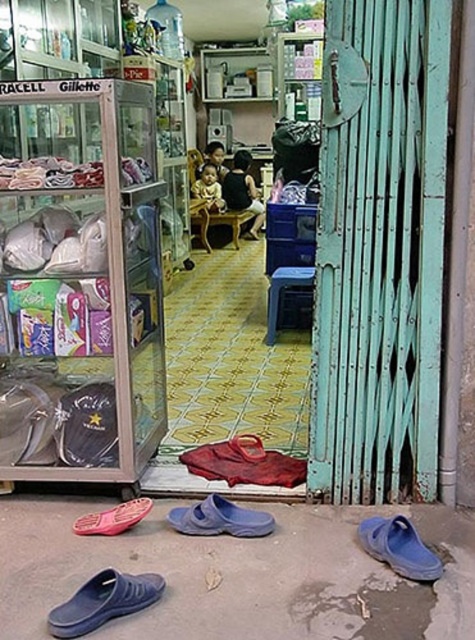
Question: Is transparent plastic display case at left to the right of teal painted metal gate at right from the viewer's perspective?

Choices:
 (A) yes
 (B) no

Answer: (B)

Question: Estimate the real-world distances between objects in this image. Which object is farther from the transparent plastic display case at left?

Choices:
 (A) blue rubber slipper at lower center
 (B) pink rubber sandal at lower left

Answer: (A)

Question: From the image, what is the correct spatial relationship of teal painted metal gate at right in relation to blue rubber slipper at lower left?

Choices:
 (A) left
 (B) right

Answer: (B)

Question: Can you confirm if transparent plastic display case at left is thinner than pink rubber sandal at lower left?

Choices:
 (A) yes
 (B) no

Answer: (B)

Question: Which object appears farthest from the camera in this image?

Choices:
 (A) pink rubber sandal at lower left
 (B) blue rubber slipper at lower center

Answer: (A)

Question: Which point appears farthest from the camera in this image?

Choices:
 (A) (26, 289)
 (B) (152, 582)
 (C) (399, 252)
 (D) (255, 516)

Answer: (A)